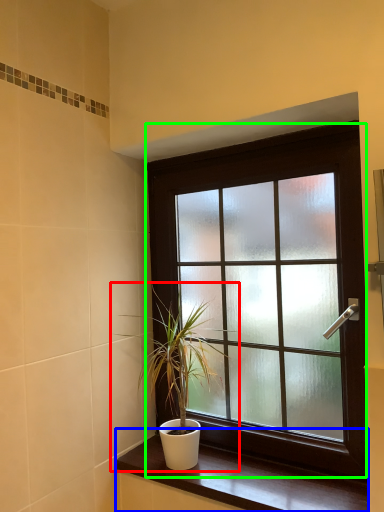
Question: Which is farther away from houseplant (highlighted by a red box)? window sill (highlighted by a blue box) or window (highlighted by a green box)?

Choices:
 (A) window sill
 (B) window

Answer: (A)